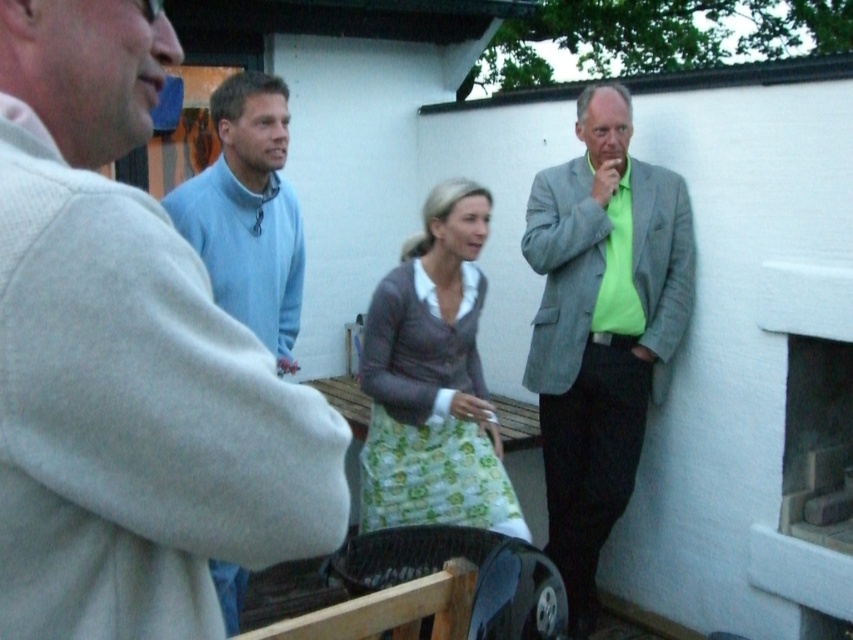
You are organizing a photo shoot and need to ensure that the light gray sweater at upper left and the white stone fireplace at right are both visible in the frame. Given their sizes, which object should you prioritize keeping in the center of the shot to avoid cropping?

The white stone fireplace at right should be prioritized in the center of the shot because it is wider than the light gray sweater at upper left, making it more likely to be cropped if not centered.

You are standing at the camera position and want to throw a ball to hit the white stone fireplace at right. If the maximum distance you can throw is 10 feet, will you be able to reach it?

The white stone fireplace at right is 10.43 feet away from the camera, which is slightly beyond your maximum throwing distance of 10 feet. Therefore, you won not be able to reach it.